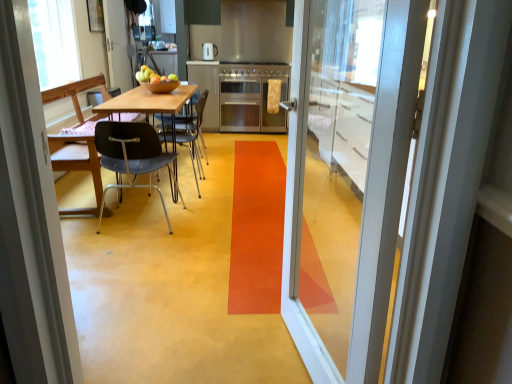
Locate an element on the screen. The width and height of the screenshot is (512, 384). free space behind black plastic chair at left, positioned as the 1th chair in right-to-left order is located at coordinates click(203, 168).